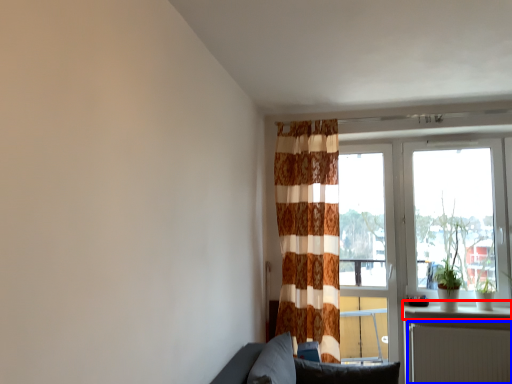
Question: Which object is further to the camera taking this photo, window sill (highlighted by a red box) or radiator (highlighted by a blue box)?

Choices:
 (A) window sill
 (B) radiator

Answer: (A)